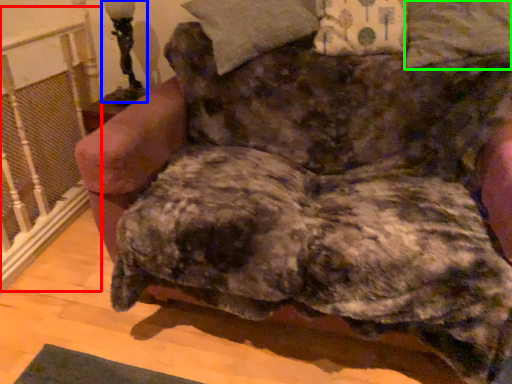
Question: Which is nearer to the rail (highlighted by a red box)? table lamp (highlighted by a blue box) or pillow (highlighted by a green box).

Choices:
 (A) table lamp
 (B) pillow

Answer: (A)